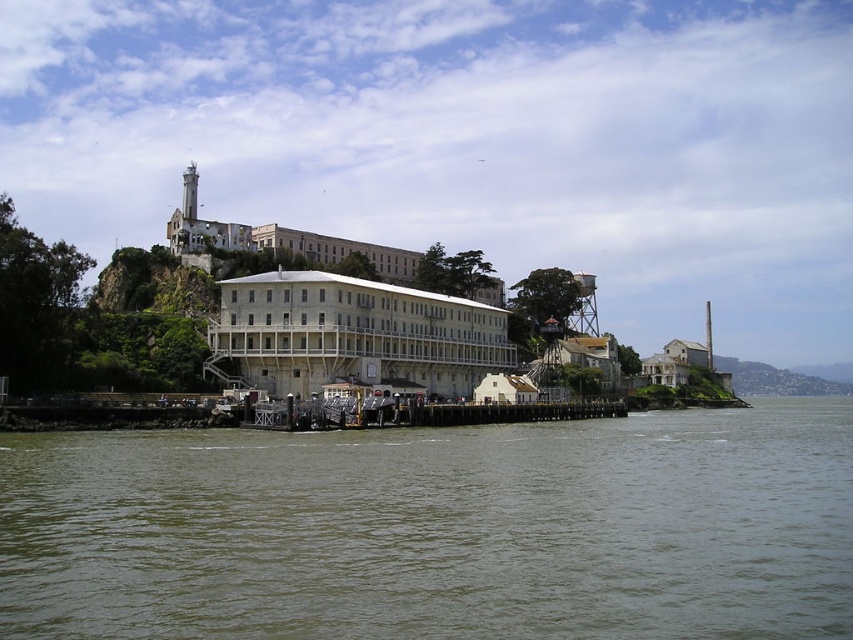
Question: Does white painted wood building at center lie behind white concrete building at center?

Choices:
 (A) no
 (B) yes

Answer: (A)

Question: Does greenish water at lower center appear on the right side of white concrete building at center?

Choices:
 (A) no
 (B) yes

Answer: (B)

Question: Which point is farther from the camera taking this photo?

Choices:
 (A) (392, 252)
 (B) (157, 531)

Answer: (A)

Question: Where is greenish water at lower center located in relation to white painted wood building at center in the image?

Choices:
 (A) above
 (B) below

Answer: (B)

Question: Which point is farther to the camera?

Choices:
 (A) white concrete building at center
 (B) greenish water at lower center
 (C) white painted wood building at center

Answer: (A)

Question: Among these points, which one is farthest from the camera?

Choices:
 (A) (497, 292)
 (B) (685, 444)
 (C) (242, 330)

Answer: (A)